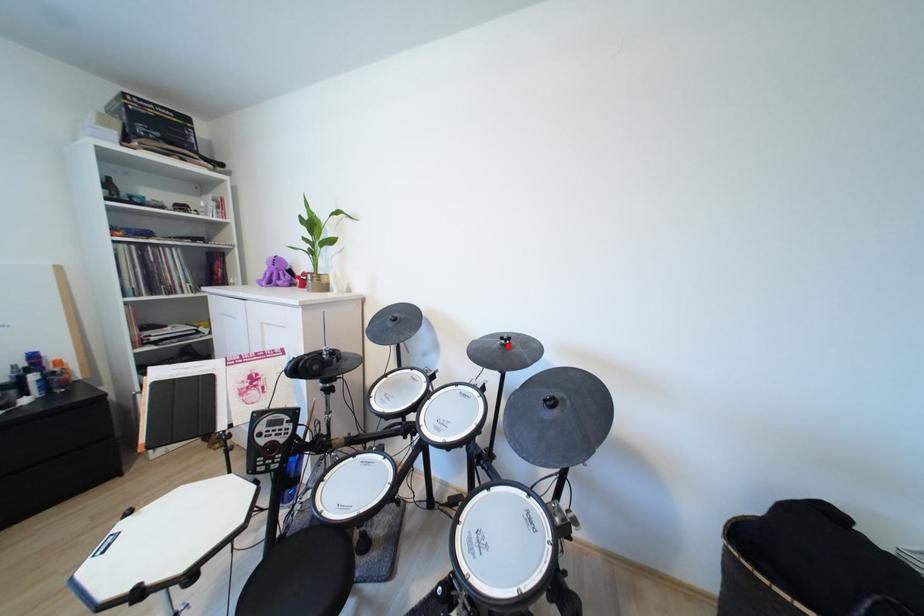
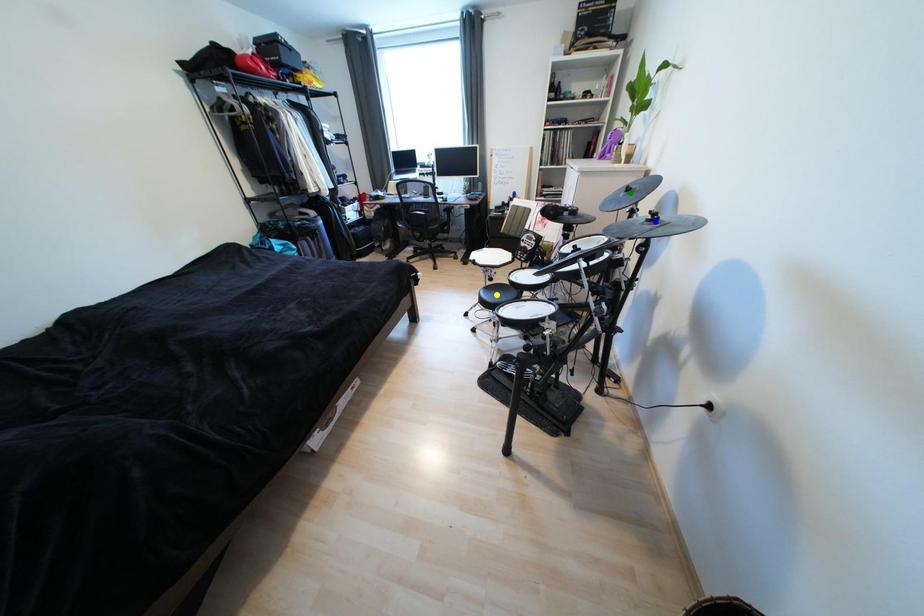
Question: I am providing you with two images of the same scene from different viewpoints. A red point is marked on the first image. You are given multiple points on the second image. Which point in image 2 is actually the same real-world point as the red point in image 1?

Choices:
 (A) blue point
 (B) green point
 (C) yellow point

Answer: (A)